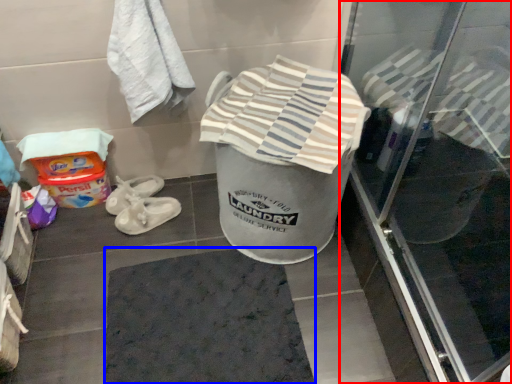
Question: Which object appears closest to the camera in this image, screen door (highlighted by a red box) or bath mat (highlighted by a blue box)?

Choices:
 (A) screen door
 (B) bath mat

Answer: (A)